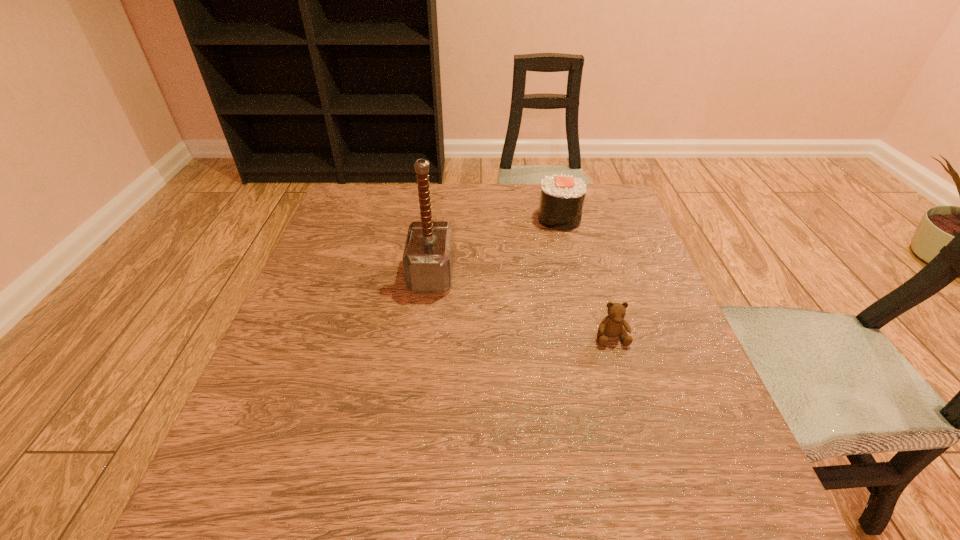
Locate an element on the screen. Image resolution: width=960 pixels, height=540 pixels. vacant space that is in between the tallest object and the second tallest object is located at coordinates (495, 246).

At what (x,y) coordinates should I click in order to perform the action: click on free space between the second tallest object and the hammer. Please return your answer as a coordinate pair (x, y). This screenshot has height=540, width=960. Looking at the image, I should click on (495, 246).

Find the location of `vacant area that lies between the second farthest object and the teddy bear`. vacant area that lies between the second farthest object and the teddy bear is located at coordinates (521, 306).

What are the coordinates of `vacant region between the farthest object and the teddy bear` in the screenshot? It's located at (585, 278).

Locate an element on the screen. empty space between the tallest object and the farthest object is located at coordinates (495, 246).

The width and height of the screenshot is (960, 540). I want to click on vacant area that lies between the nearest object and the leftmost object, so click(521, 306).

The height and width of the screenshot is (540, 960). Find the location of `unoccupied position between the second tallest object and the teddy bear`. unoccupied position between the second tallest object and the teddy bear is located at coordinates (585, 278).

At what (x,y) coordinates should I click in order to perform the action: click on vacant region between the shortest object and the farthest object. Please return your answer as a coordinate pair (x, y). This screenshot has height=540, width=960. Looking at the image, I should click on (585, 278).

Locate which object ranks second in proximity to the shortest object. Please provide its 2D coordinates. Your answer should be formatted as a tuple, i.e. [(x, y)], where the tuple contains the x and y coordinates of a point satisfying the conditions above.

[(562, 197)]

This screenshot has height=540, width=960. Identify the location of object that is the second closest to the second farthest object. (611, 326).